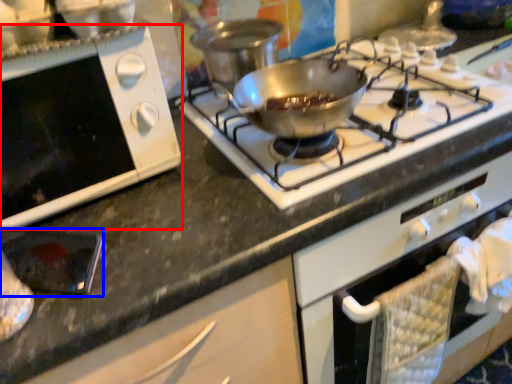
Question: Which of the following is the closest to the observer, oven (highlighted by a red box) or appliance (highlighted by a blue box)?

Choices:
 (A) oven
 (B) appliance

Answer: (A)